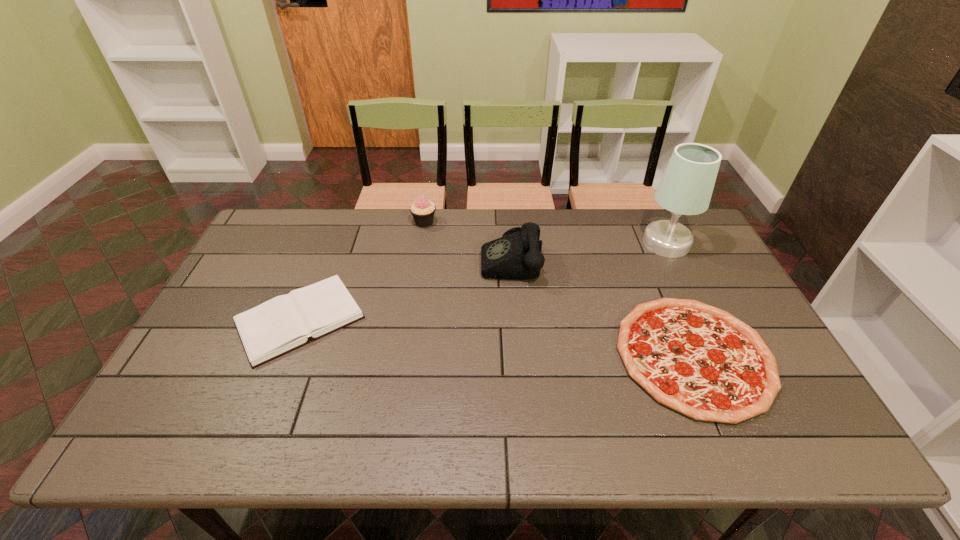
Find the location of a particular element. This screenshot has width=960, height=540. lampshade is located at coordinates (686, 187).

The height and width of the screenshot is (540, 960). In order to click on telephone in this screenshot , I will do `click(517, 255)`.

Locate an element on the screen. cupcake is located at coordinates (422, 210).

Locate an element on the screen. The width and height of the screenshot is (960, 540). the leftmost object is located at coordinates (278, 326).

This screenshot has height=540, width=960. Find the location of `the fourth tallest object`. the fourth tallest object is located at coordinates (278, 326).

At what (x,y) coordinates should I click in order to perform the action: click on the shortest object. Please return your answer as a coordinate pair (x, y). Looking at the image, I should click on (699, 360).

Where is `free space located on the base of the tallest object`? free space located on the base of the tallest object is located at coordinates (618, 243).

Identify the location of vacant space located 0.330m on the base of the tallest object. The image size is (960, 540). (543, 243).

The image size is (960, 540). I want to click on free space located 0.400m on the base of the tallest object, so click(523, 243).

The image size is (960, 540). In order to click on vacant area located on the dial of the telephone in this screenshot , I will do `click(400, 258)`.